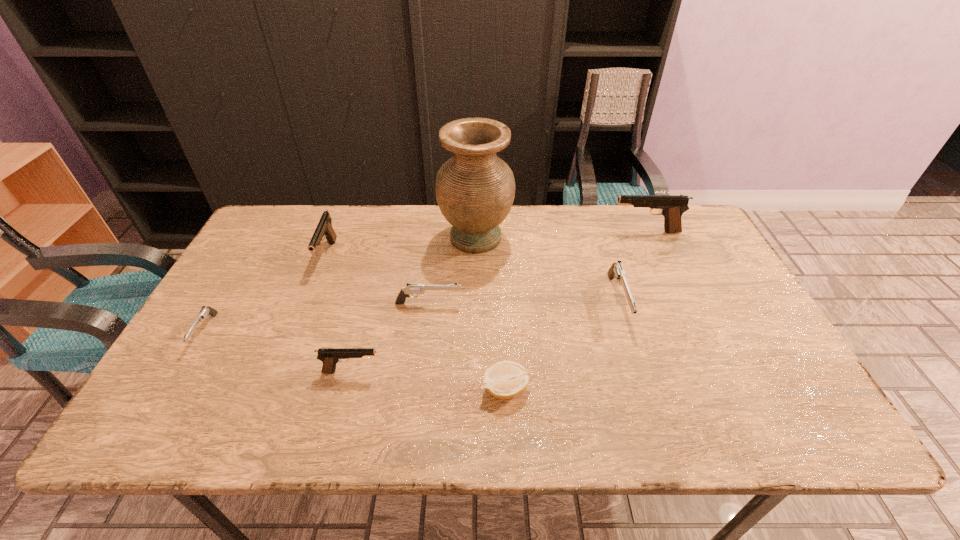
Image resolution: width=960 pixels, height=540 pixels. In order to click on vacant space located on the front-facing side of the fifth pistol from left to right in this screenshot , I will do `click(644, 384)`.

This screenshot has width=960, height=540. In order to click on free spot located at the muzzle of the nearest black pistol in this screenshot , I will do `click(457, 371)`.

You are a GUI agent. You are given a task and a screenshot of the screen. Output one action in this format:
    pyautogui.click(x=<x>, y=<y>)
    Task: Click on the vacant space positioned 0.380m on the front-facing side of the fourth pistol from left to right
    
    Given the screenshot: What is the action you would take?
    603,303

The image size is (960, 540). What are the coordinates of `blank area located on the front-facing side of the leftmost pistol` in the screenshot? It's located at (170, 393).

Find the location of a particular element. The image size is (960, 540). free region located on the left of the yellow lemon is located at coordinates 361,389.

Where is `vase present at the far edge`? The height and width of the screenshot is (540, 960). vase present at the far edge is located at coordinates (475, 189).

Identify the location of object at the near edge. (505, 379).

Where is `object that is at the left edge`? This screenshot has width=960, height=540. object that is at the left edge is located at coordinates (205, 311).

Locate an element on the screen. The width and height of the screenshot is (960, 540). object positioned at the right edge is located at coordinates (672, 207).

Find the location of `object that is at the far right corner`. object that is at the far right corner is located at coordinates (672, 207).